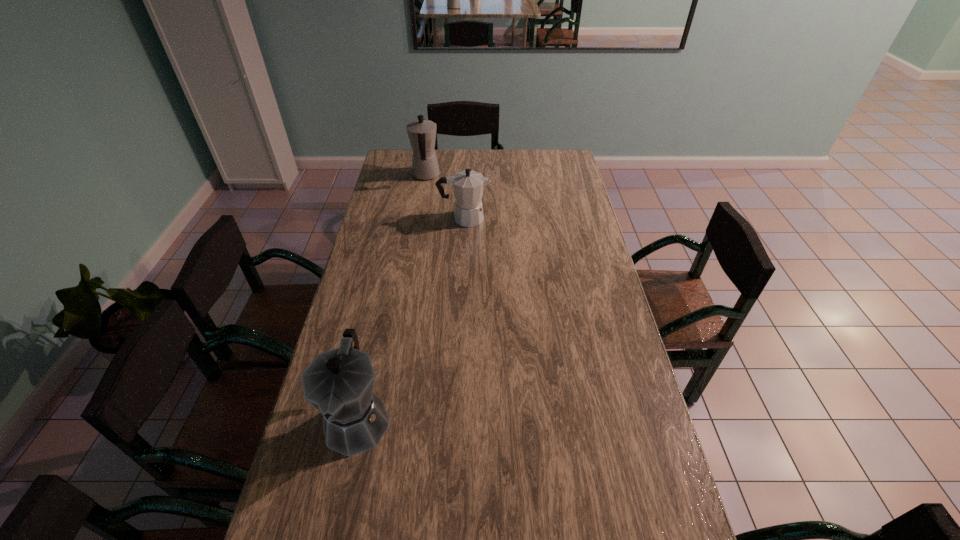
Where is `free location that satisfies the following two spatial constraints: 1. at the spout of the second farthest coffeepot; 2. at the spout of the nearest object`? free location that satisfies the following two spatial constraints: 1. at the spout of the second farthest coffeepot; 2. at the spout of the nearest object is located at coordinates (455, 419).